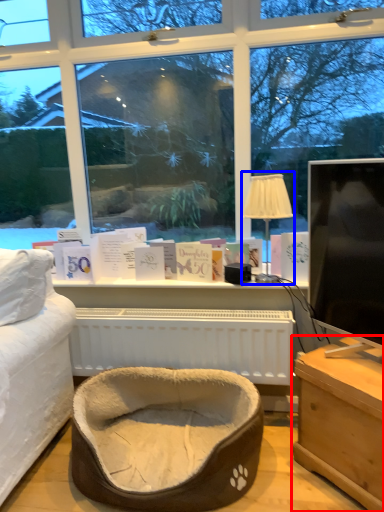
Question: Which object is further to the camera taking this photo, table (highlighted by a red box) or table lamp (highlighted by a blue box)?

Choices:
 (A) table
 (B) table lamp

Answer: (B)